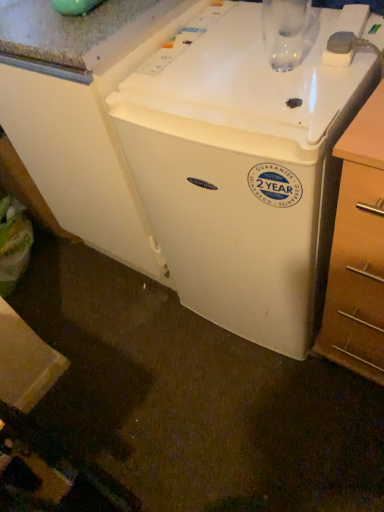
This screenshot has width=384, height=512. Find the location of `vacant space situated above white plastic refrigerator at center (from a real-world perspective)`. vacant space situated above white plastic refrigerator at center (from a real-world perspective) is located at coordinates (248, 55).